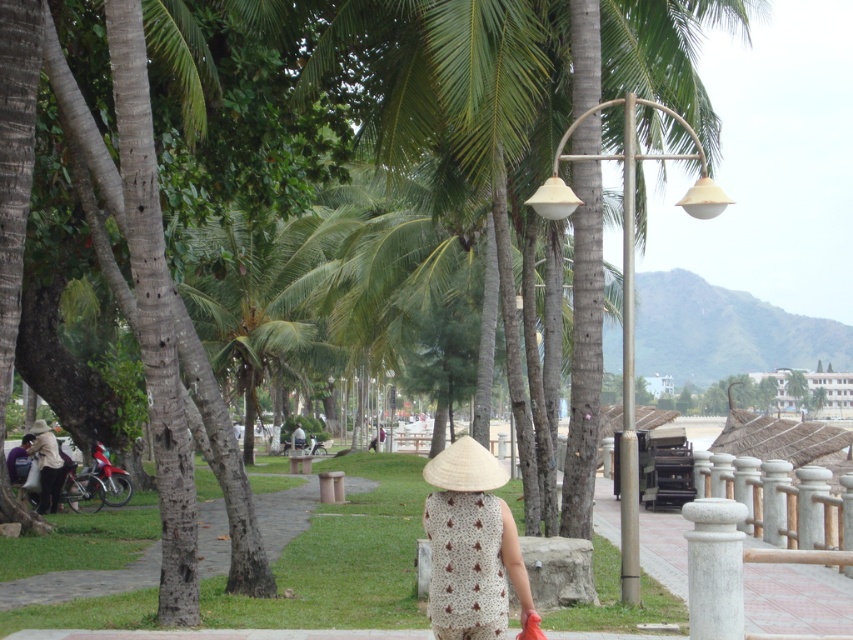
From the picture: You are a photographer planning to capture the white straw hat at center in your shot. The green grass at lower center is blocking the view. Can you adjust your angle to avoid the grass?

The green grass at lower center is bigger than the white straw hat at center, so adjusting your angle might help to frame the hat without the grass obstruction.

You are a tourist in this tropical park and want to take a photo of the green grass at lower center and the white straw hat at center. To get them both in the frame, should you adjust your camera to focus more on the left or the right side?

The green grass at lower center is positioned on the left side of white straw hat at center, so to capture both in the frame, you should adjust your camera to focus more on the left side to include the green grass at lower center and the white straw hat at center.

You are a photographer trying to capture both the white straw hat at center and the light brown woven hat at lower left in a single frame. Which hat will appear narrower in the photo?

The white straw hat at center will appear narrower in the photo because it is thinner than the light brown woven hat at lower left.